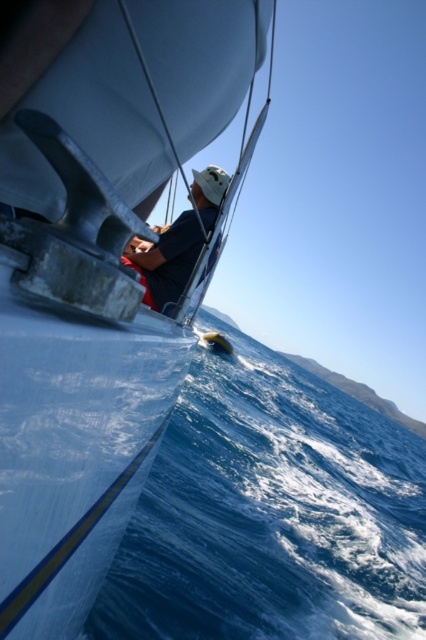
You are on a boat and need to know if there is enough space to move around. Considering the white matte sailboat at center and the blue water at lower left, which one has a larger width?

The blue water at lower left has a larger width than the white matte sailboat at center.

You are navigating a sailboat and need to position the white matte sailboat at center for an upcoming maneuver. Based on its current coordinates, can you determine its exact position relative to the boat deck?

The white matte sailboat at center is located at point coordinates of 0.425 along the x and 0.230 along the y axis.